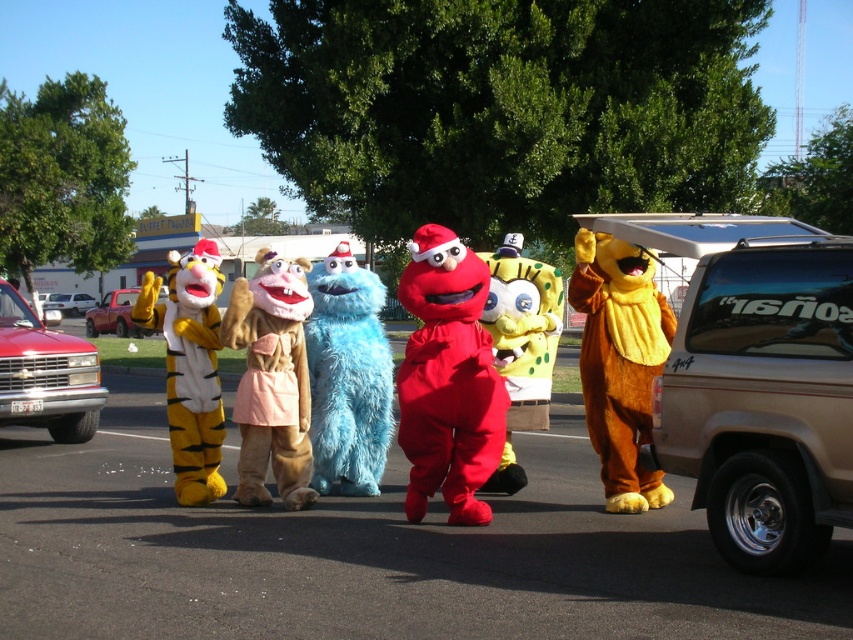
Who is positioned more to the left, fuzzy brown bear at center or fuzzy blue monster at center?

fuzzy blue monster at center is more to the left.

Is point (641, 355) positioned in front of point (338, 465)?

Yes.

Where is `fuzzy brown bear at center`? This screenshot has width=853, height=640. fuzzy brown bear at center is located at coordinates (619, 362).

Who is shorter, matte red costume at center or white plastic car at left?

white plastic car at left is shorter.

In the scene shown: Can you confirm if matte red costume at center is bigger than white plastic car at left?

Indeed, matte red costume at center has a larger size compared to white plastic car at left.

Measure the distance between point (438, 448) and camera.

A distance of 6.89 meters exists between point (438, 448) and camera.

In order to click on matte red costume at center in this screenshot , I will do `click(448, 380)`.

Which is above, fuzzy brown bear at center or white plastic car at left?

white plastic car at left is above.

Does fuzzy brown bear at center have a smaller size compared to white plastic car at left?

Actually, fuzzy brown bear at center might be larger than white plastic car at left.

I want to click on fuzzy brown bear at center, so click(x=619, y=362).

You are a GUI agent. You are given a task and a screenshot of the screen. Output one action in this format:
    pyautogui.click(x=<x>, y=<y>)
    Task: Click on the fuzzy brown bear at center
    
    Given the screenshot: What is the action you would take?
    pyautogui.click(x=619, y=362)